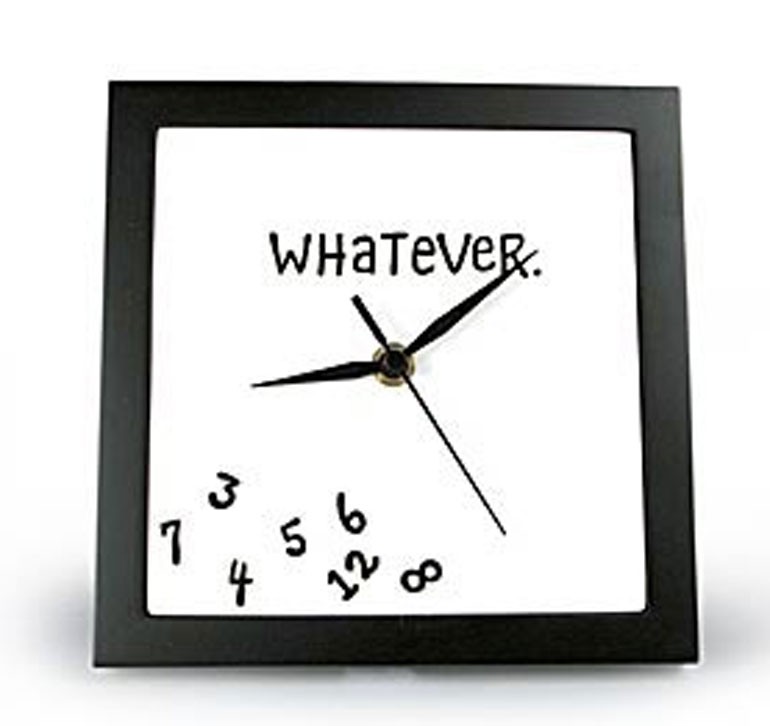
Locate an element on the screen. Image resolution: width=770 pixels, height=726 pixels. clock is located at coordinates (396, 358).